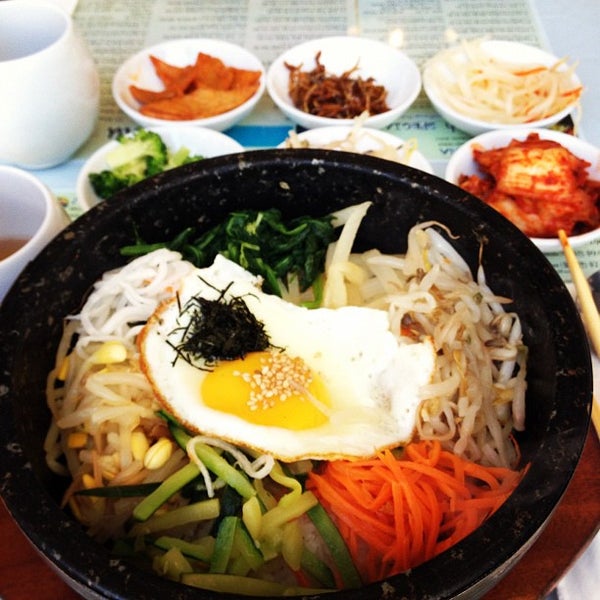
Where is `chopstick`? Image resolution: width=600 pixels, height=600 pixels. chopstick is located at coordinates (593, 297).